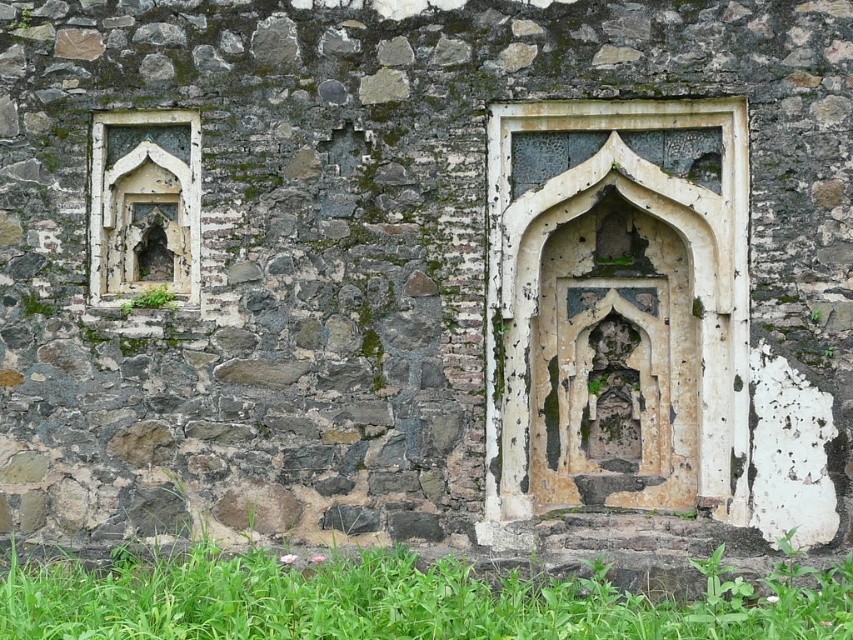
Is white stone arch at center in front of green leafy weed at lower left?

Yes.

Can you confirm if white stone arch at center is smaller than green leafy weed at lower left?

No.

Is point (635, 140) more distant than point (171, 305)?

That is False.

Image resolution: width=853 pixels, height=640 pixels. I want to click on white stone arch at center, so click(616, 305).

Which is more to the right, green grass at lower center or stone/rough stone arch at left?

Positioned to the right is green grass at lower center.

Image resolution: width=853 pixels, height=640 pixels. Describe the element at coordinates (403, 600) in the screenshot. I see `green grass at lower center` at that location.

Based on the photo, who is more forward, (732, 595) or (134, 161)?

Point (732, 595)

The height and width of the screenshot is (640, 853). Find the location of `green grass at lower center`. green grass at lower center is located at coordinates (403, 600).

Is green grass at lower center thinner than green leafy weed at lower left?

In fact, green grass at lower center might be wider than green leafy weed at lower left.

Based on the photo, does green grass at lower center appear on the right side of green leafy weed at lower left?

Yes, green grass at lower center is to the right of green leafy weed at lower left.

Is point (817, 602) positioned behind point (173, 298)?

No, (817, 602) is closer to viewer.

The height and width of the screenshot is (640, 853). Identify the location of green grass at lower center. (403, 600).